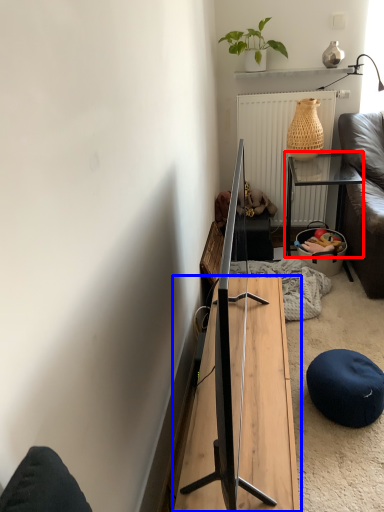
Question: Which of the following is the farthest to the observer, table (highlighted by a red box) or table (highlighted by a blue box)?

Choices:
 (A) table
 (B) table

Answer: (A)